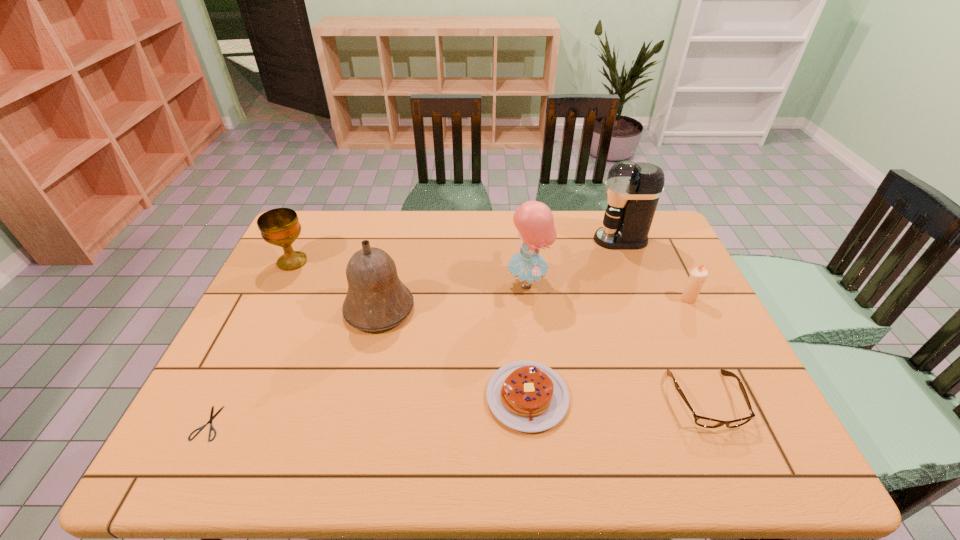
I want to click on object that is positioned at the far left corner, so click(x=280, y=227).

This screenshot has height=540, width=960. I want to click on object present at the near left corner, so click(212, 417).

What are the coordinates of `object that is at the far right corner` in the screenshot? It's located at (633, 190).

Identify the location of object present at the near right corner. The height and width of the screenshot is (540, 960). (705, 422).

This screenshot has width=960, height=540. In the image, there is a desktop. Identify the location of blank space at the far edge. (343, 243).

The image size is (960, 540). In the image, there is a desktop. Identify the location of vacant space at the near edge. (304, 454).

Locate an element on the screen. Image resolution: width=960 pixels, height=540 pixels. vacant space at the left edge of the desktop is located at coordinates (262, 401).

Identify the location of vacant space at the right edge of the desktop. This screenshot has height=540, width=960. (660, 279).

This screenshot has width=960, height=540. Find the location of `free location at the near right corner`. free location at the near right corner is located at coordinates (722, 455).

Where is `vacant space that is in between the farthest object and the shears`? vacant space that is in between the farthest object and the shears is located at coordinates (415, 332).